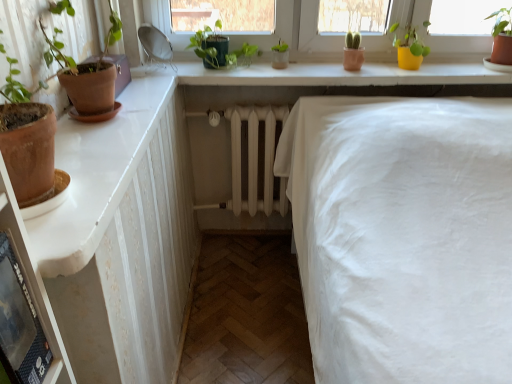
Where is `free area in between green matte plant at upper center, acting as the 1th houseplant starting from the left, and green matte flowerpot at center`? free area in between green matte plant at upper center, acting as the 1th houseplant starting from the left, and green matte flowerpot at center is located at coordinates (269, 65).